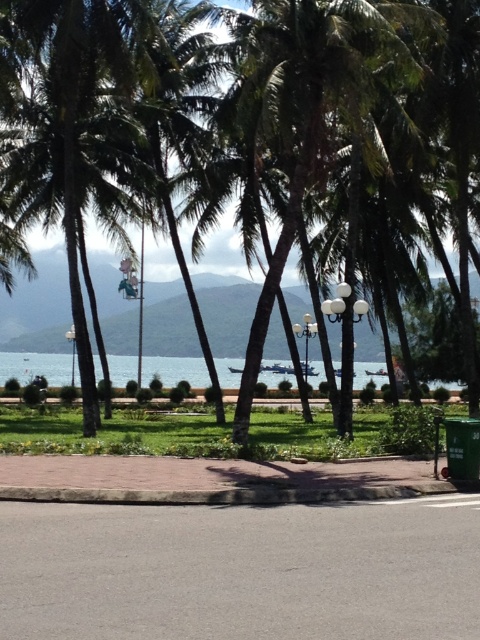
You are planning to install a new bench along the pathway in the coastal scene. The bench requires a minimum of 60 feet of space between the green leafy coconut tree at center and the clear blue water at center to ensure safety. Based on the scene description, is the current distance sufficient for placing the bench?

The distance between the green leafy coconut tree at center and the clear blue water at center is 59.09 feet, which is less than the required 60 feet. Therefore, the current distance is not sufficient for placing the bench safely.

Consider the image. You are a tourist standing on the pathway and want to take a photo of both the green leafy coconut tree at center and the clear blue water at center. Which object should you focus on first to ensure both are in the frame?

You should focus on the green leafy coconut tree at center first because it is in front of the clear blue water at center, so adjusting the camera to include the tree will naturally include the water behind it.